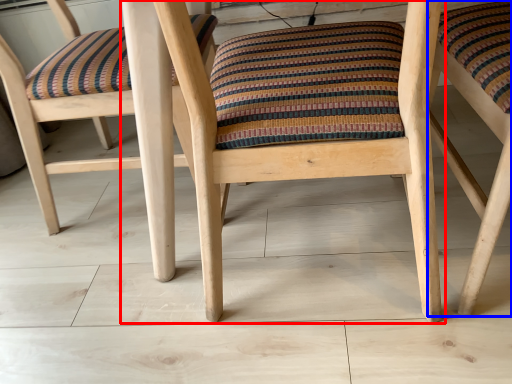
Question: Which object appears closest to the camera in this image, chair (highlighted by a red box) or chair (highlighted by a blue box)?

Choices:
 (A) chair
 (B) chair

Answer: (A)